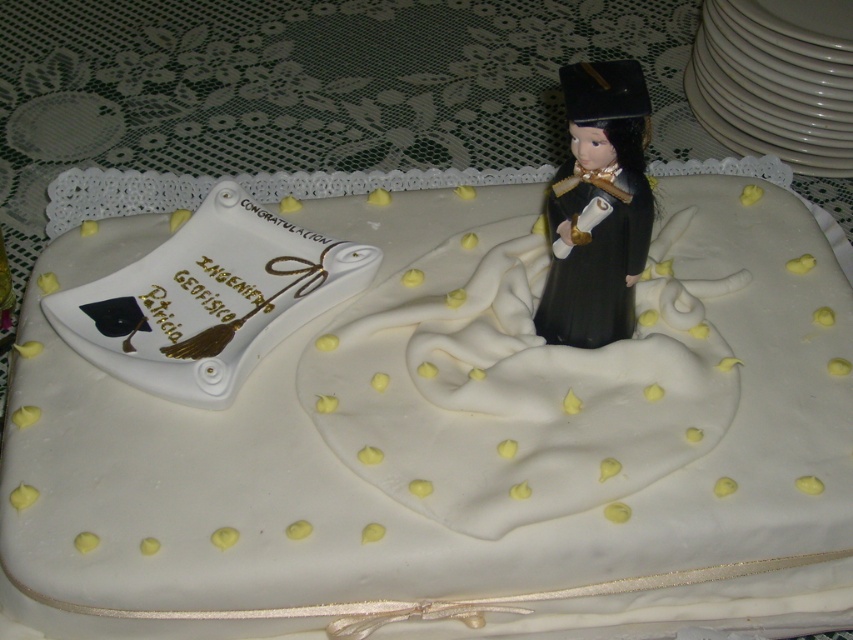
In the scene shown: Which is more to the right, white fondant cake at center or black matte figurine at upper right?

Positioned to the right is black matte figurine at upper right.

Which is more to the left, white fondant cake at center or black matte figurine at upper right?

Positioned to the left is white fondant cake at center.

Where is `white fondant cake at center`? The image size is (853, 640). white fondant cake at center is located at coordinates (451, 440).

Locate an element on the screen. The width and height of the screenshot is (853, 640). white fondant cake at center is located at coordinates (451, 440).

Between white fondant cake at center and white porcelain platter at upper right, which one is positioned lower?

white fondant cake at center is lower down.

From the picture: Between white fondant cake at center and white porcelain platter at upper right, which one is positioned higher?

white porcelain platter at upper right is above.

This screenshot has height=640, width=853. In order to click on white fondant cake at center in this screenshot , I will do `click(451, 440)`.

Between black matte figurine at upper right and white porcelain platter at upper right, which one is positioned lower?

black matte figurine at upper right is lower down.

Measure the distance between black matte figurine at upper right and camera.

black matte figurine at upper right and camera are 29.65 inches apart.

I want to click on black matte figurine at upper right, so click(x=601, y=196).